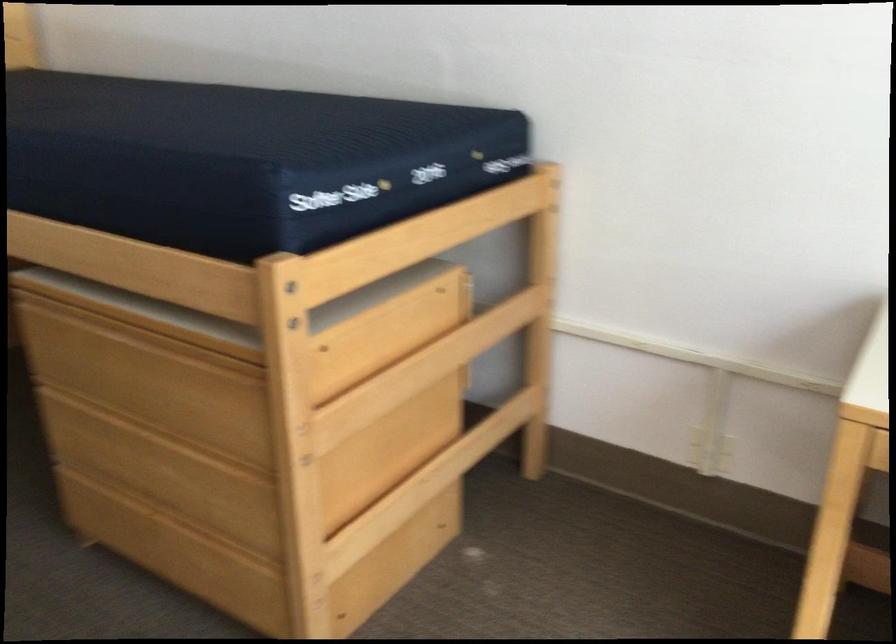
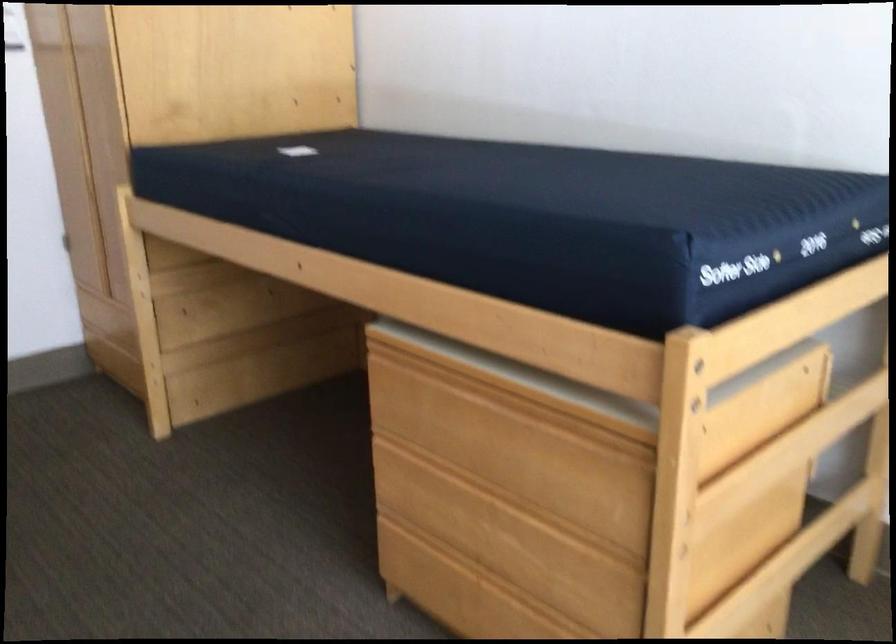
Where in the second image is the point corresponding to point 186,406 from the first image?

(540, 471)